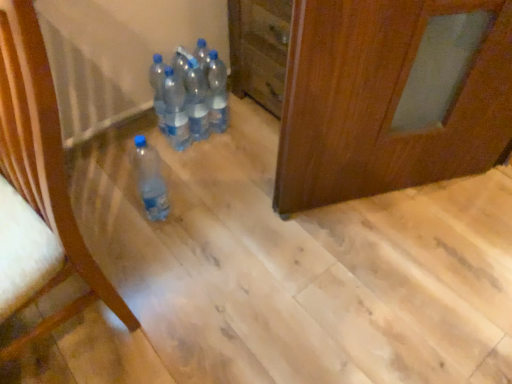
I want to click on vacant space that is in between clear plastic bottle at left and transparent plastic bottles at center, the 5th bottle when ordered from right to left, so click(133, 220).